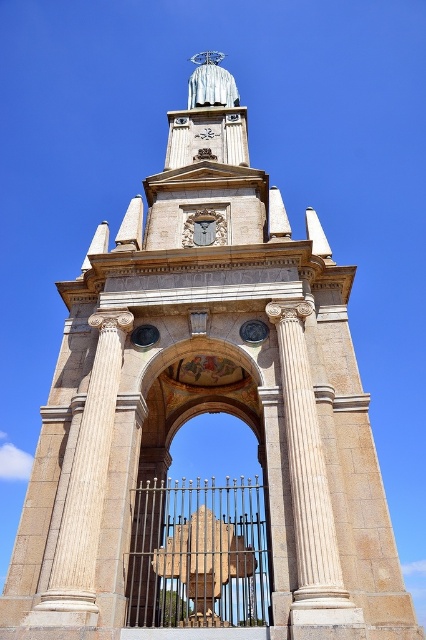
You are an architect examining the monument. You notice the gold textured gate at center and the wooden carving at center. Which object is positioned to the right of the other?

The gold textured gate at center is positioned to the right of the wooden carving at center.

You are an architect designing a new gate for the monument. The existing gold textured gate at center is wider than the white marble column at center. If you want to maintain symmetry between the gate and the columns, what adjustment should you make to the new gate?

Since the gold textured gate at center is wider than the white marble column at center, to maintain symmetry, the new gate should be designed to match the width of the white marble column at center.

You are an architect visiting the monument and want to compare the height of the gold textured gate at center and the wooden carving at center. Which one is taller?

The gold textured gate at center is taller than the wooden carving at center.